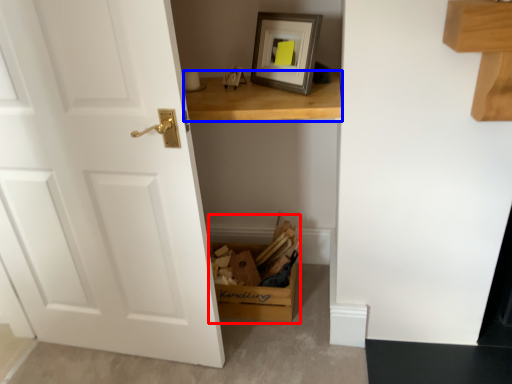
Question: Which object is closer to the camera taking this photo, cardboard box (highlighted by a red box) or table (highlighted by a blue box)?

Choices:
 (A) cardboard box
 (B) table

Answer: (B)